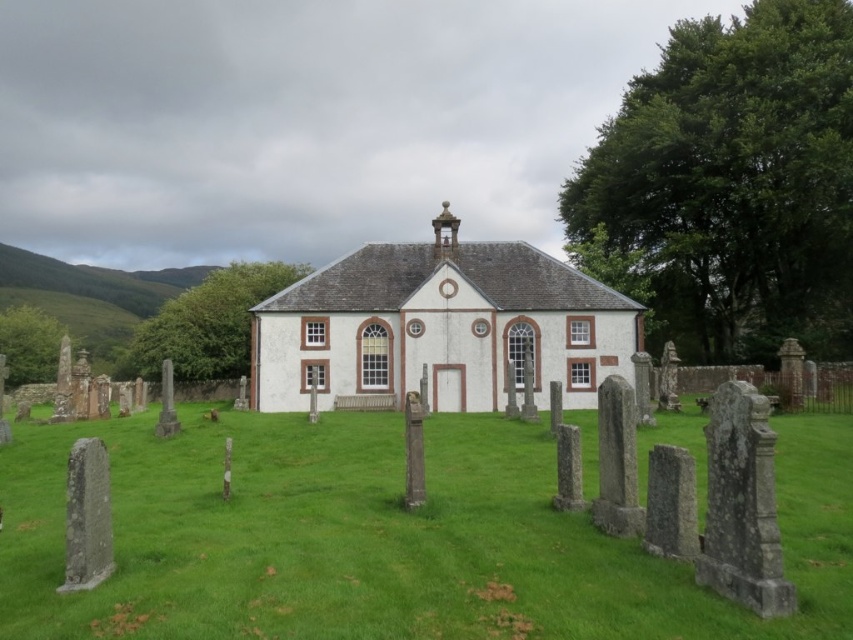
Question: Is green grass at center bigger than white painted wood church at center?

Choices:
 (A) yes
 (B) no

Answer: (B)

Question: Can you confirm if green grass at center is smaller than white painted wood church at center?

Choices:
 (A) no
 (B) yes

Answer: (B)

Question: Is green grass at center closer to the viewer compared to white painted wood church at center?

Choices:
 (A) yes
 (B) no

Answer: (A)